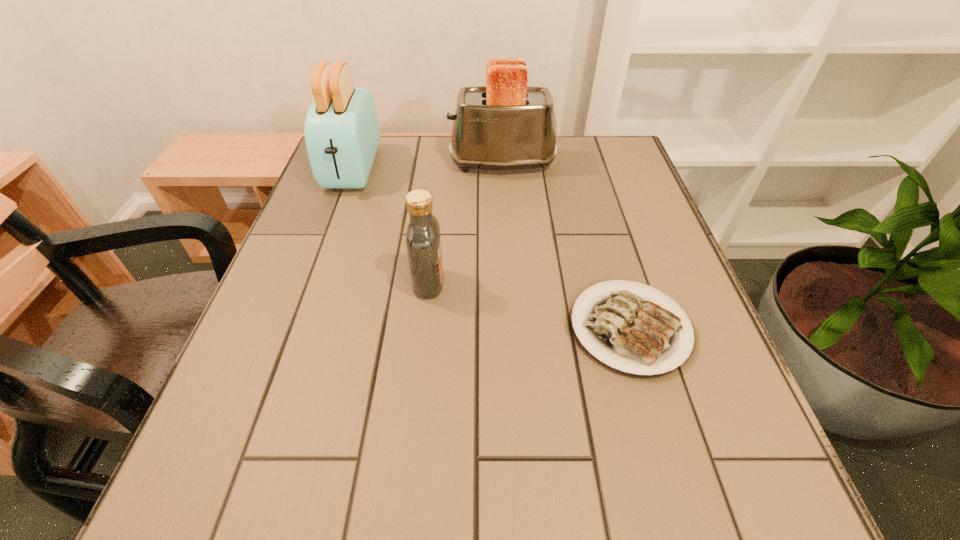
You are a GUI agent. You are given a task and a screenshot of the screen. Output one action in this format:
    pyautogui.click(x=<x>, y=<y>)
    Task: Click on the free spot that satisfies the following two spatial constraints: 1. on the side of the leftmost object with the lever; 2. on the left side of the plate
    The image size is (960, 540).
    Given the screenshot: What is the action you would take?
    pyautogui.click(x=295, y=328)

Where is `vacant area that satisfies the following two spatial constraints: 1. on the side of the right toaster with the control lever; 2. on the side of the leftmost object with the lever`? Image resolution: width=960 pixels, height=540 pixels. vacant area that satisfies the following two spatial constraints: 1. on the side of the right toaster with the control lever; 2. on the side of the leftmost object with the lever is located at coordinates 502,169.

The image size is (960, 540). In order to click on free space that satisfies the following two spatial constraints: 1. on the side of the right toaster with the control lever; 2. on the side of the left toaster with the lever in this screenshot , I will do `click(502, 169)`.

Where is `free spot that satisfies the following two spatial constraints: 1. on the side of the right toaster with the control lever; 2. on the side of the leftmost object with the lever`? The width and height of the screenshot is (960, 540). free spot that satisfies the following two spatial constraints: 1. on the side of the right toaster with the control lever; 2. on the side of the leftmost object with the lever is located at coordinates (502, 169).

Where is `free point that satisfies the following two spatial constraints: 1. on the side of the plate with the control lever; 2. on the right side of the right toaster`? This screenshot has height=540, width=960. free point that satisfies the following two spatial constraints: 1. on the side of the plate with the control lever; 2. on the right side of the right toaster is located at coordinates (513, 328).

Where is `vacant position in the image that satisfies the following two spatial constraints: 1. on the side of the right toaster with the control lever; 2. on the side of the leftmost object with the lever`? The image size is (960, 540). vacant position in the image that satisfies the following two spatial constraints: 1. on the side of the right toaster with the control lever; 2. on the side of the leftmost object with the lever is located at coordinates (502, 169).

This screenshot has width=960, height=540. I want to click on vacant point that satisfies the following two spatial constraints: 1. on the back side of the shortest object; 2. on the front-facing side of the third tallest object, so click(616, 283).

Locate an element on the screen. This screenshot has width=960, height=540. vacant area that satisfies the following two spatial constraints: 1. on the side of the plate with the lever; 2. on the left side of the left toaster is located at coordinates (295, 328).